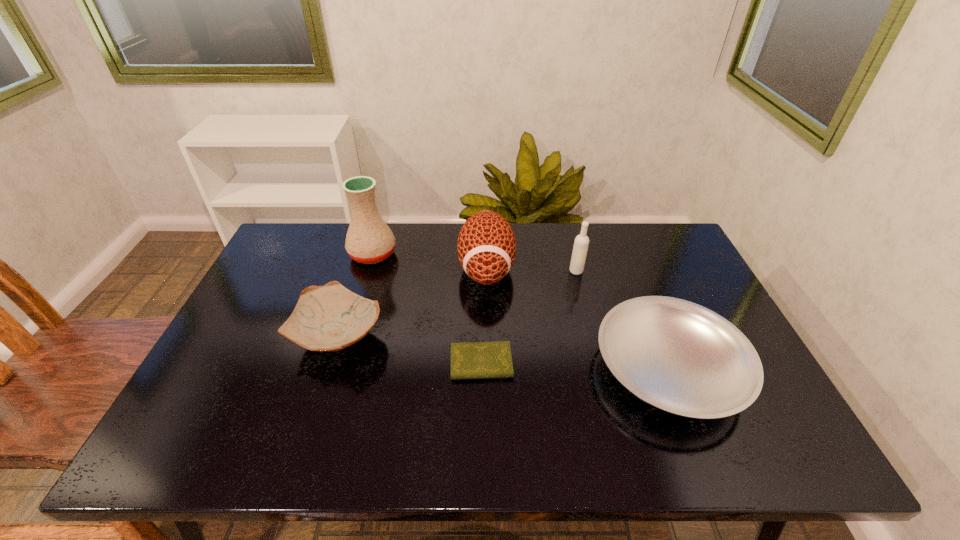
Find the location of a particular element. The width and height of the screenshot is (960, 540). unoccupied area between the shortest object and the farther pottery is located at coordinates (x=427, y=308).

Where is `object that stands as the fifth closest to the bedpan`? This screenshot has width=960, height=540. object that stands as the fifth closest to the bedpan is located at coordinates (369, 240).

In order to click on the second closest object to the shortest object in this screenshot , I will do `click(330, 318)`.

Identify the location of blank area in the image that satisfies the following two spatial constraints: 1. on the back side of the fourth tallest object; 2. on the left side of the tallest object. This screenshot has width=960, height=540. (366, 254).

Where is `free space that satisfies the following two spatial constraints: 1. on the front side of the diary; 2. on the right side of the bedpan`? This screenshot has width=960, height=540. free space that satisfies the following two spatial constraints: 1. on the front side of the diary; 2. on the right side of the bedpan is located at coordinates (481, 368).

What are the coordinates of `vacant area in the image that satisfies the following two spatial constraints: 1. on the front side of the taller pottery; 2. on the right side of the shortest object` in the screenshot? It's located at (341, 363).

You are a GUI agent. You are given a task and a screenshot of the screen. Output one action in this format:
    pyautogui.click(x=<x>, y=<y>)
    Task: Click on the free space that satisfies the following two spatial constraints: 1. on the front side of the football; 2. on the left side of the vodka
    This screenshot has height=540, width=960.
    Given the screenshot: What is the action you would take?
    pyautogui.click(x=487, y=271)